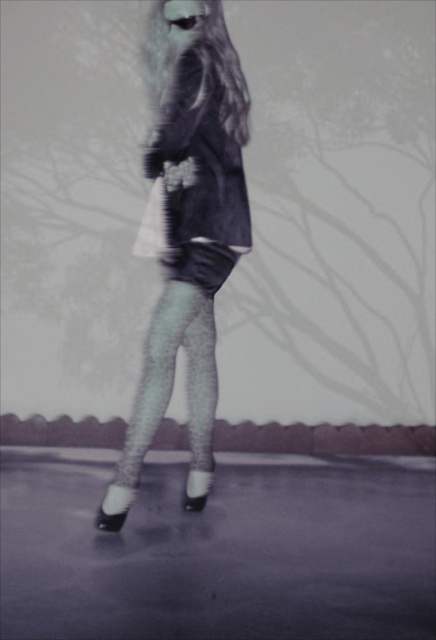
Question: Can you confirm if fluffy black coat at center is smaller than fuzzy black dress at center?

Choices:
 (A) yes
 (B) no

Answer: (B)

Question: Is fuzzy black dress at center bigger than glittery tights at center?

Choices:
 (A) no
 (B) yes

Answer: (B)

Question: Which point is closer to the camera?

Choices:
 (A) glittery tights at center
 (B) fluffy black coat at center

Answer: (B)

Question: Which of the following is the farthest from the observer?

Choices:
 (A) (132, 467)
 (B) (183, 108)

Answer: (A)

Question: Can you confirm if fuzzy black dress at center is positioned below glittery tights at center?

Choices:
 (A) no
 (B) yes

Answer: (A)

Question: Estimate the real-world distances between objects in this image. Which object is closer to the glittery tights at center?

Choices:
 (A) fluffy black coat at center
 (B) fuzzy black dress at center

Answer: (A)